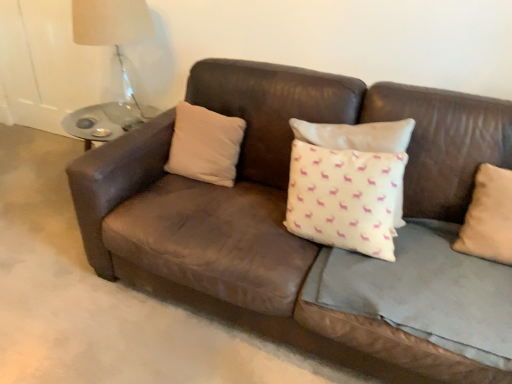
Describe the element at coordinates (489, 217) in the screenshot. The width and height of the screenshot is (512, 384). I see `beige fabric pillow at right, the 2th pillow positioned from the back` at that location.

Image resolution: width=512 pixels, height=384 pixels. What do you see at coordinates (275, 203) in the screenshot? I see `brown leather couch at center` at bounding box center [275, 203].

What are the coordinates of `brown leather couch at center` in the screenshot? It's located at (275, 203).

Locate an element on the screen. This screenshot has height=384, width=512. white matte pillow at center, which is counted as the 1th pillow, starting from the back is located at coordinates (205, 145).

Where is `beige fabric pillow at right, the 2th pillow positioned from the back`? This screenshot has width=512, height=384. beige fabric pillow at right, the 2th pillow positioned from the back is located at coordinates (489, 217).

Does point (510, 248) come in front of point (172, 156)?

Yes, it is in front of point (172, 156).

From a real-world perspective, who is located higher, beige fabric pillow at right, the first pillow from the front, or white matte pillow at center, which is counted as the 1th pillow, starting from the back?

From a 3D spatial view, beige fabric pillow at right, the first pillow from the front, is above.

In the scene shown: Which object is closer to the camera taking this photo, beige fabric pillow at right, the 2th pillow positioned from the back, or white matte pillow at center, the 2th pillow from the right?

beige fabric pillow at right, the 2th pillow positioned from the back.

Is white matte pillow at center, which is the second pillow in front-to-back order, at the back of beige fabric pillow at right, the 1th pillow viewed from the right?

beige fabric pillow at right, the 1th pillow viewed from the right, does not have its back to white matte pillow at center, which is the second pillow in front-to-back order.

Is the surface of brown leather couch at center in direct contact with translucent glass table lamp at upper left?

brown leather couch at center and translucent glass table lamp at upper left are clearly separated.

From the image's perspective, which one is positioned lower, brown leather couch at center or translucent glass table lamp at upper left?

brown leather couch at center appears lower in the image.

In the scene shown: From a real-world perspective, is brown leather couch at center positioned above or below translucent glass table lamp at upper left?

brown leather couch at center is below translucent glass table lamp at upper left.

Is translucent glass table lamp at upper left inside brown leather couch at center?

No.

Is point (123, 82) farther from viewer compared to point (481, 242)?

That is True.

Looking at this image, is translucent glass table lamp at upper left not close to beige fabric pillow at right, the second pillow in the left-to-right sequence?

Yes, translucent glass table lamp at upper left is far from beige fabric pillow at right, the second pillow in the left-to-right sequence.

Is white matte pillow at center, the 1th pillow in the left-to-right sequence, not within translucent glass table lamp at upper left?

Yes, white matte pillow at center, the 1th pillow in the left-to-right sequence, is located beyond the bounds of translucent glass table lamp at upper left.

Which of these two, white matte pillow at center, which is counted as the 1th pillow, starting from the back, or translucent glass table lamp at upper left, is wider?

With larger width is translucent glass table lamp at upper left.

From a real-world perspective, between white matte pillow at center, the 1th pillow in the left-to-right sequence, and translucent glass table lamp at upper left, who is vertically higher?

translucent glass table lamp at upper left.

Visually, is white matte pillow at center, which is counted as the 1th pillow, starting from the back, positioned to the left or to the right of translucent glass table lamp at upper left?

From the image, it's evident that white matte pillow at center, which is counted as the 1th pillow, starting from the back, is to the right of translucent glass table lamp at upper left.

Which object is positioned more to the left, brown leather couch at center or beige fabric pillow at right, the 1th pillow viewed from the right?

From the viewer's perspective, brown leather couch at center appears more on the left side.

Does point (421, 357) come in front of point (493, 227)?

Yes.

Looking at their sizes, would you say brown leather couch at center is wider or thinner than beige fabric pillow at right, the second pillow in the left-to-right sequence?

In the image, brown leather couch at center appears to be wider than beige fabric pillow at right, the second pillow in the left-to-right sequence.

Find the location of a particular element. This screenshot has height=384, width=512. studio couch below the beige fabric pillow at right, the first pillow from the front (from a real-world perspective) is located at coordinates (275, 203).

Looking at this image, does beige fabric pillow at right, the second pillow in the left-to-right sequence, have a greater height compared to translucent glass table lamp at upper left?

No.

From the image's perspective, is beige fabric pillow at right, the second pillow in the left-to-right sequence, located above translucent glass table lamp at upper left?

Actually, beige fabric pillow at right, the second pillow in the left-to-right sequence, appears below translucent glass table lamp at upper left in the image.

Is beige fabric pillow at right, the second pillow in the left-to-right sequence, completely or partially outside of translucent glass table lamp at upper left?

Indeed, beige fabric pillow at right, the second pillow in the left-to-right sequence, is completely outside translucent glass table lamp at upper left.

From a real-world perspective, is white matte pillow at center, the 2th pillow from the right, on beige fabric pillow at right, the second pillow in the left-to-right sequence?

Actually, white matte pillow at center, the 2th pillow from the right, is physically below beige fabric pillow at right, the second pillow in the left-to-right sequence, in the real world.

Which is more to the right, white matte pillow at center, which is the second pillow in front-to-back order, or beige fabric pillow at right, the first pillow from the front?

Positioned to the right is beige fabric pillow at right, the first pillow from the front.

Does white matte pillow at center, which is the second pillow in front-to-back order, have a greater width compared to beige fabric pillow at right, the 1th pillow viewed from the right?

Incorrect, the width of white matte pillow at center, which is the second pillow in front-to-back order, does not surpass that of beige fabric pillow at right, the 1th pillow viewed from the right.

From the image's perspective, between white matte pillow at center, which is the second pillow in front-to-back order, and beige fabric pillow at right, the second pillow in the left-to-right sequence, who is located below?

beige fabric pillow at right, the second pillow in the left-to-right sequence, appears lower in the image.

What are the coordinates of `pillow below the beige fabric pillow at right, the 2th pillow positioned from the back (from a real-world perspective)` in the screenshot? It's located at (205, 145).

The height and width of the screenshot is (384, 512). Find the location of `table lamp behind the brown leather couch at center`. table lamp behind the brown leather couch at center is located at coordinates (113, 31).

Which object lies nearer to the anchor point beige fabric pillow at right, the 1th pillow viewed from the right, white matte pillow at center, which is counted as the 1th pillow, starting from the back, or translucent glass table lamp at upper left?

Among the two, white matte pillow at center, which is counted as the 1th pillow, starting from the back, is located nearer to beige fabric pillow at right, the 1th pillow viewed from the right.

Which object lies further to the anchor point white matte pillow at center, the 1th pillow in the left-to-right sequence, translucent glass table lamp at upper left or brown leather couch at center?

translucent glass table lamp at upper left.

Estimate the real-world distances between objects in this image. Which object is further from translucent glass table lamp at upper left, beige fabric pillow at right, the 2th pillow positioned from the back, or white matte pillow at center, which is counted as the 1th pillow, starting from the back?

beige fabric pillow at right, the 2th pillow positioned from the back.

From the image, which object appears to be nearer to brown leather couch at center, beige fabric pillow at right, the second pillow in the left-to-right sequence, or white matte pillow at center, the 1th pillow in the left-to-right sequence?

Among the two, white matte pillow at center, the 1th pillow in the left-to-right sequence, is located nearer to brown leather couch at center.

When comparing their distances from brown leather couch at center, does white matte pillow at center, the 2th pillow from the right, or beige fabric pillow at right, the 2th pillow positioned from the back, seem further?

beige fabric pillow at right, the 2th pillow positioned from the back, is further to brown leather couch at center.

Which object lies further to the anchor point brown leather couch at center, beige fabric pillow at right, the second pillow in the left-to-right sequence, or translucent glass table lamp at upper left?

Among the two, translucent glass table lamp at upper left is located further to brown leather couch at center.

Based on their spatial positions, is brown leather couch at center or translucent glass table lamp at upper left further from beige fabric pillow at right, the second pillow in the left-to-right sequence?

translucent glass table lamp at upper left.

Considering their positions, is brown leather couch at center positioned further to translucent glass table lamp at upper left than beige fabric pillow at right, the 2th pillow positioned from the back?

beige fabric pillow at right, the 2th pillow positioned from the back, lies further to translucent glass table lamp at upper left than the other object.

Locate an element on the screen. pillow located between brown leather couch at center and beige fabric pillow at right, the first pillow from the front, in the left-right direction is located at coordinates (205, 145).

Locate an element on the screen. The height and width of the screenshot is (384, 512). pillow located between translucent glass table lamp at upper left and beige fabric pillow at right, the second pillow in the left-to-right sequence, in the left-right direction is located at coordinates (205, 145).

Find the location of `studio couch located between translucent glass table lamp at upper left and beige fabric pillow at right, the 1th pillow viewed from the right, in the left-right direction`. studio couch located between translucent glass table lamp at upper left and beige fabric pillow at right, the 1th pillow viewed from the right, in the left-right direction is located at coordinates (275, 203).